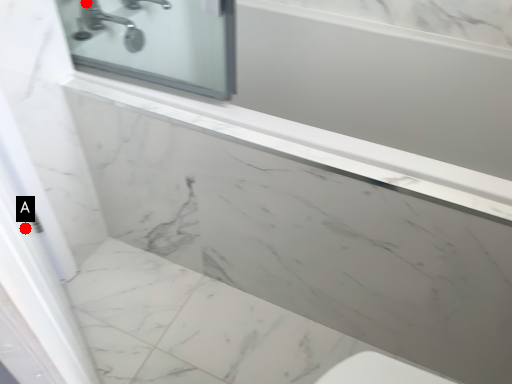
Question: Two points are circled on the image, labeled by A and B beside each circle. Which point is closer to the camera?

Choices:
 (A) A is closer
 (B) B is closer

Answer: (A)